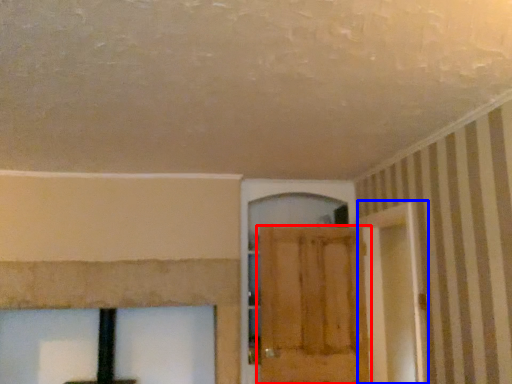
Question: Which point is further to the camera, door (highlighted by a red box) or screen door (highlighted by a blue box)?

Choices:
 (A) door
 (B) screen door

Answer: (A)